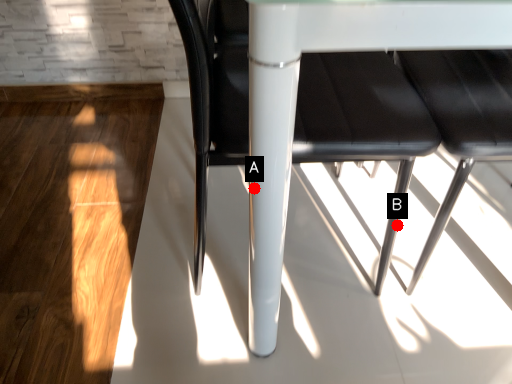
Question: Two points are circled on the image, labeled by A and B beside each circle. Which of the following is the farthest from the observer?

Choices:
 (A) A is further
 (B) B is further

Answer: (B)